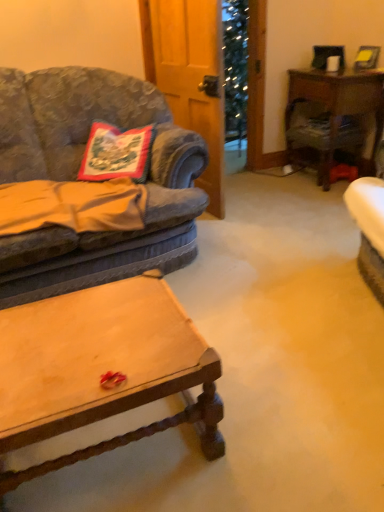
Question: From a real-world perspective, relative to wooden desk at right, is wooden coffee table at center vertically above or below?

Choices:
 (A) below
 (B) above

Answer: (A)

Question: Is wooden coffee table at center to the left or to the right of wooden desk at right in the image?

Choices:
 (A) right
 (B) left

Answer: (B)

Question: Estimate the real-world distances between objects in this image. Which object is farther from the wooden coffee table at center?

Choices:
 (A) velvet fabric couch at left
 (B) wooden desk at right
 (C) embroidered fabric pillow at left

Answer: (B)

Question: Which object is the farthest from the wooden desk at right?

Choices:
 (A) embroidered fabric pillow at left
 (B) wooden coffee table at center
 (C) velvet fabric couch at left

Answer: (B)